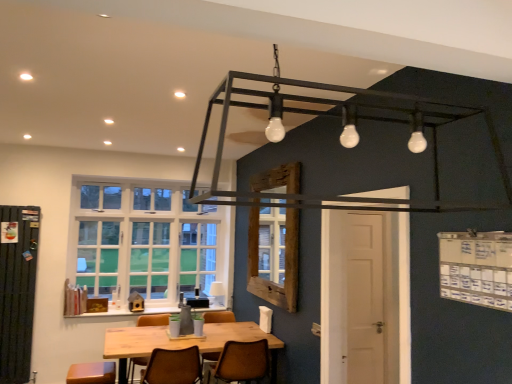
Question: Considering the positions of point (133, 352) and point (211, 292), is point (133, 352) closer or farther from the camera than point (211, 292)?

Choices:
 (A) closer
 (B) farther

Answer: (A)

Question: In terms of height, does wooden table at center look taller or shorter compared to white ceramic lamp at center?

Choices:
 (A) tall
 (B) short

Answer: (A)

Question: Based on their relative distances, which object is nearer to the white ceramic lamp at center?

Choices:
 (A) wooden frame at center, the first window from the right
 (B) metallic black frame at upper center
 (C) wooden table at center
 (D) brown leather chair at lower center, marked as the first chair in a right-to-left arrangement
 (E) white glass window at left, which appears as the 1th window when viewed from the back

Answer: (E)

Question: Which object is positioned closest to the white ceramic lamp at center?

Choices:
 (A) brown leather chair at lower center, marked as the first chair in a right-to-left arrangement
 (B) brown leather chair at center, the 2th chair viewed from the right
 (C) wooden table at center
 (D) metallic black frame at upper center
 (E) wooden frame at center, the first window from the right

Answer: (C)